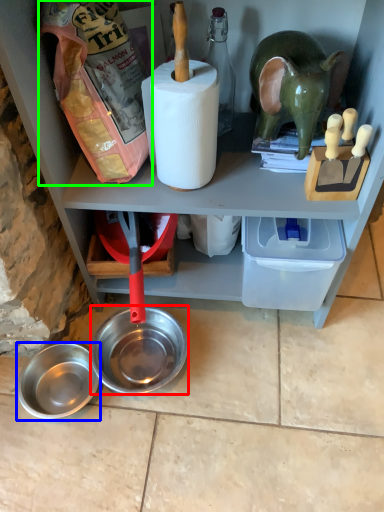
Question: Which object is the closest to the bowl (highlighted by a red box)? Choose among these: bowl (highlighted by a blue box) or stuff (highlighted by a green box).

Choices:
 (A) bowl
 (B) stuff

Answer: (A)